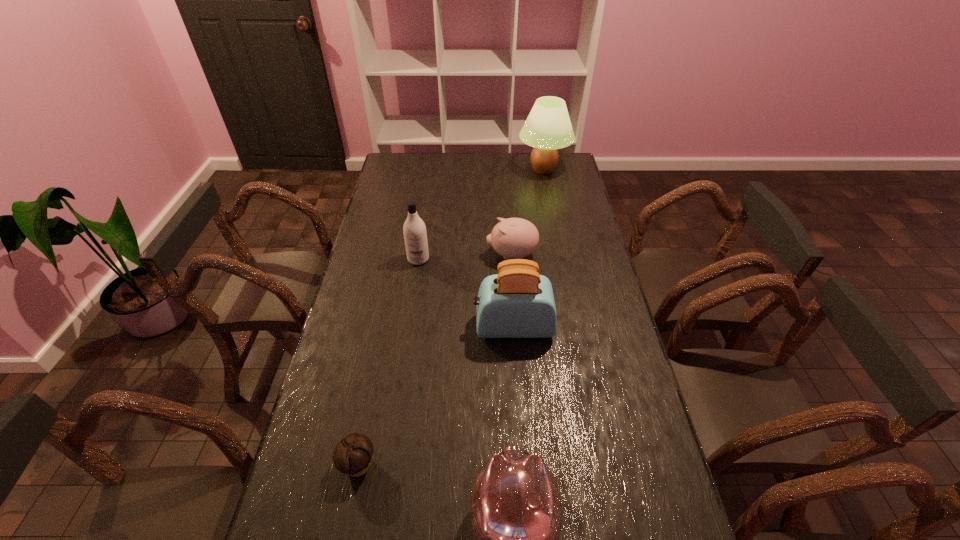
Where is `the farthest object`? the farthest object is located at coordinates (548, 127).

Where is `lampshade`? The width and height of the screenshot is (960, 540). lampshade is located at coordinates (548, 127).

Where is `toaster`? The height and width of the screenshot is (540, 960). toaster is located at coordinates (517, 302).

Identify the location of shampoo. This screenshot has height=540, width=960. (415, 236).

The image size is (960, 540). What are the coordinates of `the shorter piggy bank` in the screenshot? It's located at (514, 238).

Where is `the second shortest object`? the second shortest object is located at coordinates (514, 238).

In order to click on muffin in this screenshot , I will do `click(353, 455)`.

The width and height of the screenshot is (960, 540). Identify the location of blank area located on the shade of the tallest object. point(460,170).

Find the location of a particular element. vacant region located 0.390m on the shade of the tallest object is located at coordinates (437, 170).

The height and width of the screenshot is (540, 960). I want to click on vacant position located 0.370m on the shade of the tallest object, so click(x=442, y=170).